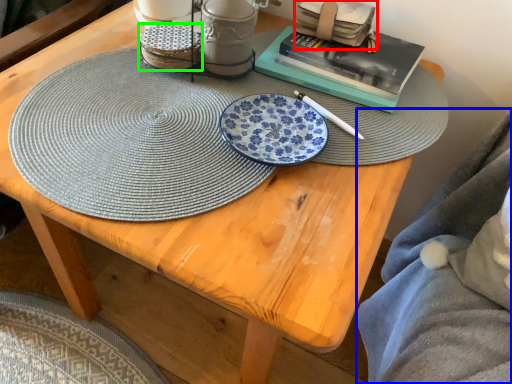
Question: Which object is positioned farthest from book (highlighted by a red box)? Select from blanket (highlighted by a blue box) and tableware (highlighted by a green box).

Choices:
 (A) blanket
 (B) tableware

Answer: (A)